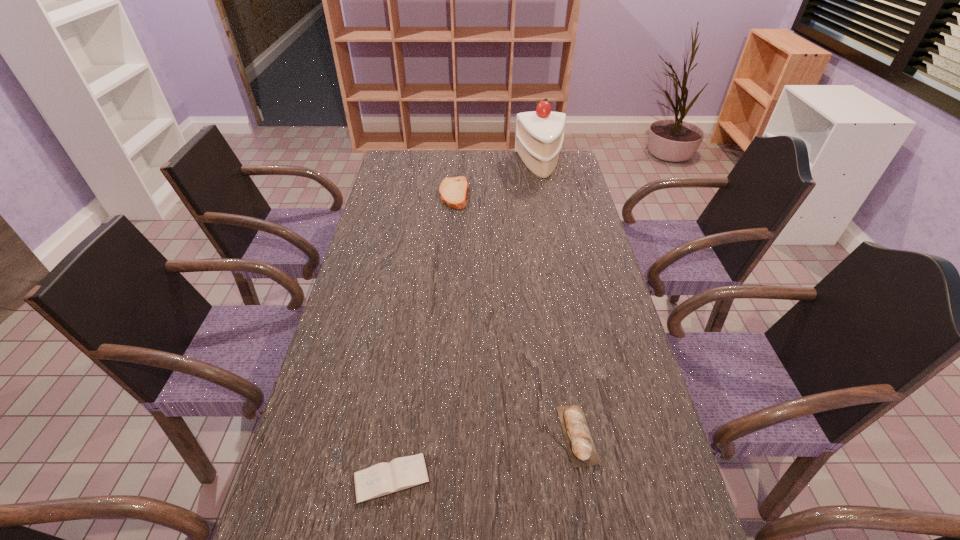
The height and width of the screenshot is (540, 960). I want to click on cake at the right edge, so (539, 137).

Identify the location of pita bread that is at the right edge. (578, 438).

Where is `object that is at the far right corner`? Image resolution: width=960 pixels, height=540 pixels. object that is at the far right corner is located at coordinates (539, 137).

Where is `free space at the far edge of the desktop`? Image resolution: width=960 pixels, height=540 pixels. free space at the far edge of the desktop is located at coordinates (497, 158).

Identify the location of free space at the left edge. (404, 259).

Identify the location of free location at the right edge of the desktop. The image size is (960, 540). pyautogui.click(x=602, y=282).

This screenshot has width=960, height=540. In the image, there is a desktop. Find the location of `vacant space at the far left corner`. vacant space at the far left corner is located at coordinates (404, 172).

Find the location of a particular element. The image size is (960, 540). free space at the far right corner of the desktop is located at coordinates (566, 159).

You are a GUI agent. You are given a task and a screenshot of the screen. Output one action in this format:
    pyautogui.click(x=<x>, y=<y>)
    Task: Click on the free spot between the tallest object and the right pita bread
    This screenshot has height=540, width=960.
    Given the screenshot: What is the action you would take?
    click(x=559, y=300)

Locate an element on the screen. The image size is (960, 540). free space between the nearer pita bread and the cake is located at coordinates (559, 300).